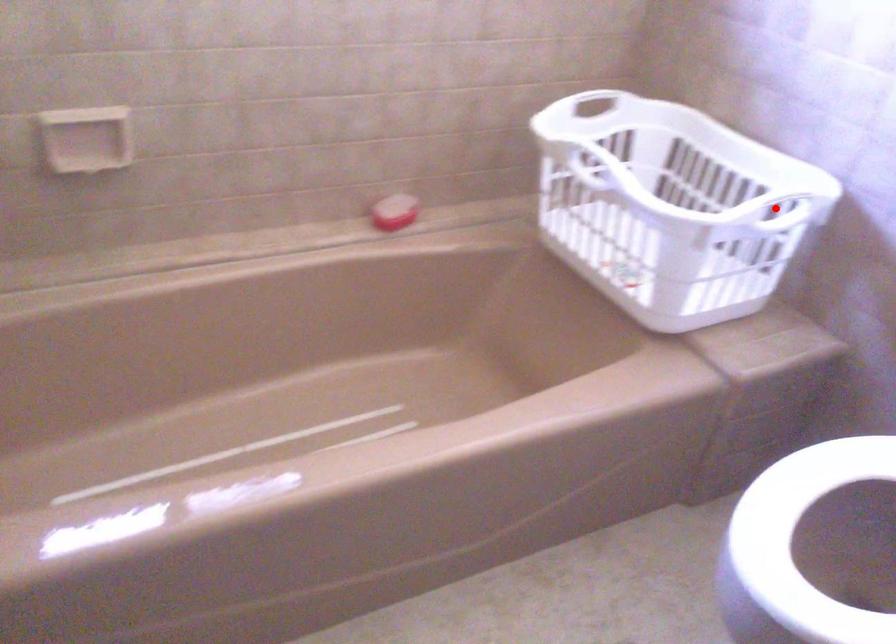
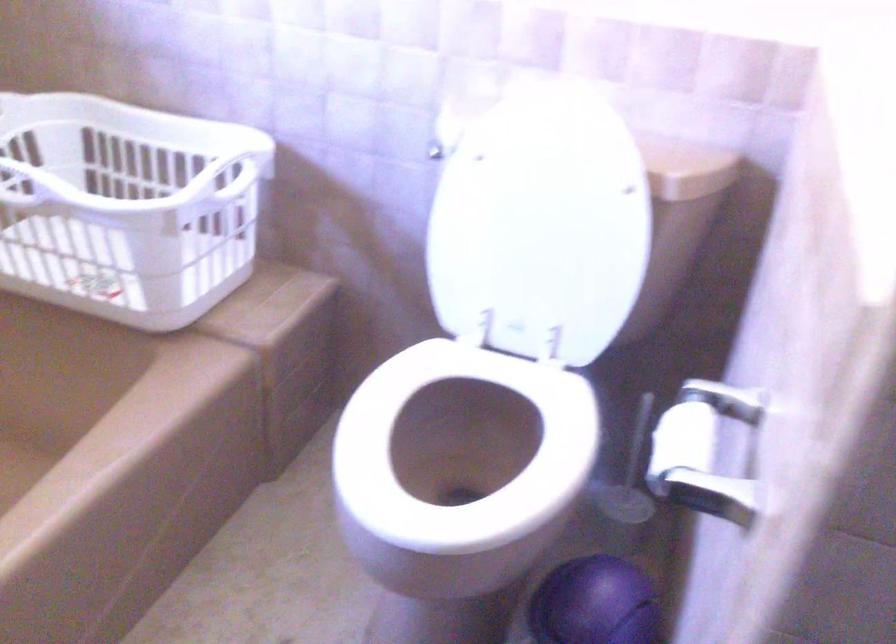
Find the pixel in the second image that matches the highlighted location in the first image.

(222, 178)